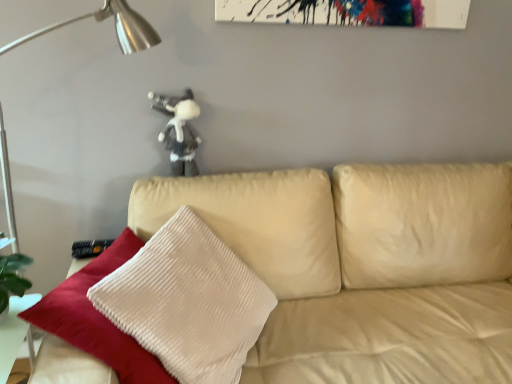
Question: Considering the relative sizes of metallic silver table lamp at left and white plush toy at upper center in the image provided, is metallic silver table lamp at left smaller than white plush toy at upper center?

Choices:
 (A) yes
 (B) no

Answer: (B)

Question: Considering the relative sizes of metallic silver table lamp at left and white plush toy at upper center in the image provided, is metallic silver table lamp at left taller than white plush toy at upper center?

Choices:
 (A) no
 (B) yes

Answer: (B)

Question: Is white plush toy at upper center at the back of metallic silver table lamp at left?

Choices:
 (A) no
 (B) yes

Answer: (B)

Question: Can you confirm if metallic silver table lamp at left is positioned to the right of white plush toy at upper center?

Choices:
 (A) yes
 (B) no

Answer: (B)

Question: Is metallic silver table lamp at left positioned in front of white plush toy at upper center?

Choices:
 (A) yes
 (B) no

Answer: (A)

Question: In terms of width, does beige leather couch at center look wider or thinner when compared to white plush toy at upper center?

Choices:
 (A) wide
 (B) thin

Answer: (A)

Question: Is point (356, 170) positioned closer to the camera than point (197, 112)?

Choices:
 (A) closer
 (B) farther

Answer: (B)

Question: From the image's perspective, relative to white plush toy at upper center, is beige leather couch at center above or below?

Choices:
 (A) above
 (B) below

Answer: (B)

Question: From a real-world perspective, relative to white plush toy at upper center, is beige leather couch at center vertically above or below?

Choices:
 (A) below
 (B) above

Answer: (A)

Question: Based on their positions, is metallic silver table lamp at left located to the left or right of white plush toy at upper center?

Choices:
 (A) left
 (B) right

Answer: (A)

Question: In the image, is metallic silver table lamp at left positioned in front of or behind white plush toy at upper center?

Choices:
 (A) front
 (B) behind

Answer: (A)

Question: Is metallic silver table lamp at left inside or outside of white plush toy at upper center?

Choices:
 (A) inside
 (B) outside

Answer: (B)

Question: Is point (126, 3) positioned closer to the camera than point (170, 172)?

Choices:
 (A) closer
 (B) farther

Answer: (A)

Question: In terms of height, does white plush toy at upper center look taller or shorter compared to metallic silver table lamp at left?

Choices:
 (A) short
 (B) tall

Answer: (A)

Question: Is point (170, 109) positioned closer to the camera than point (8, 173)?

Choices:
 (A) farther
 (B) closer

Answer: (B)